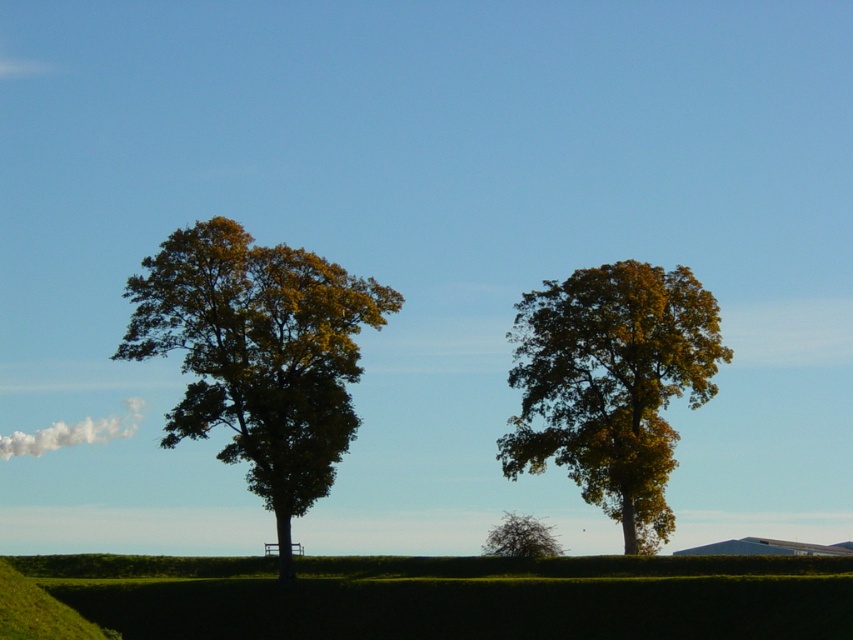
Question: Among these objects, which one is farthest from the camera?

Choices:
 (A) green leafy tree at lower center
 (B) golden yellow leaves at center
 (C) green hedge at center
 (D) green leafy tree at left

Answer: (A)

Question: Which object is farther from the camera taking this photo?

Choices:
 (A) green hedge at center
 (B) golden yellow leaves at center
 (C) green leafy tree at lower center
 (D) green leafy tree at left

Answer: (C)

Question: Does green hedge at center have a smaller size compared to green leafy tree at lower center?

Choices:
 (A) yes
 (B) no

Answer: (B)

Question: Does green leafy tree at left appear on the left side of golden yellow leaves at center?

Choices:
 (A) no
 (B) yes

Answer: (B)

Question: From the image, what is the correct spatial relationship of green leafy tree at left in relation to green leafy tree at lower center?

Choices:
 (A) right
 (B) left

Answer: (B)

Question: Among these objects, which one is nearest to the camera?

Choices:
 (A) green leafy tree at left
 (B) golden yellow leaves at center
 (C) green hedge at center
 (D) green leafy tree at lower center

Answer: (C)